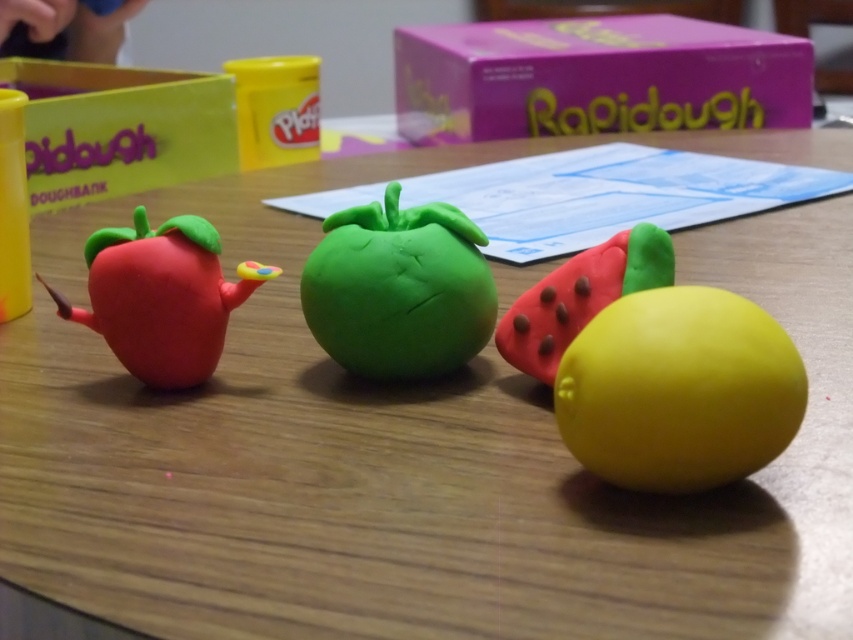
You are a child trying to stack the green clay apple at center and the matte plastic strawberry at left on top of each other. Which one should you place at the bottom to make the stack stable?

The green clay apple at center is much taller than the matte plastic strawberry at left, so placing the taller green clay apple at center at the bottom will provide a more stable base for the stack.

You are organizing a playdough art display and need to place the yellow matte lemon at lower right in a specific location. What are the coordinates of its current position?

The yellow matte lemon at lower right is currently positioned at coordinates point (679, 388).